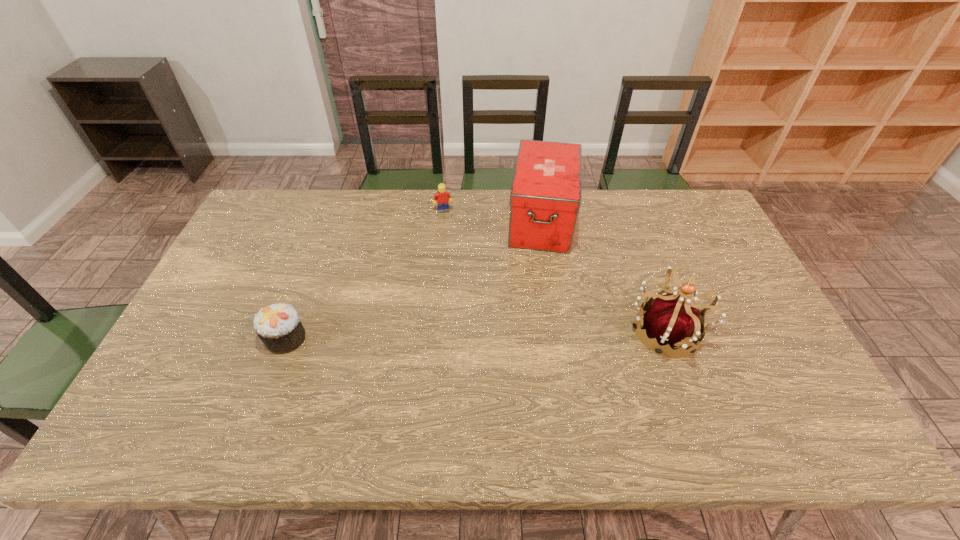
This screenshot has height=540, width=960. I want to click on free spot on the desktop that is between the cupcake and the rightmost object and is positioned on the front-facing side of the third object from right to left, so tap(478, 335).

Locate an element on the screen. The image size is (960, 540). vacant space on the desktop that is between the cupcake and the rightmost object and is positioned on the handle side of the first-aid kit is located at coordinates (530, 334).